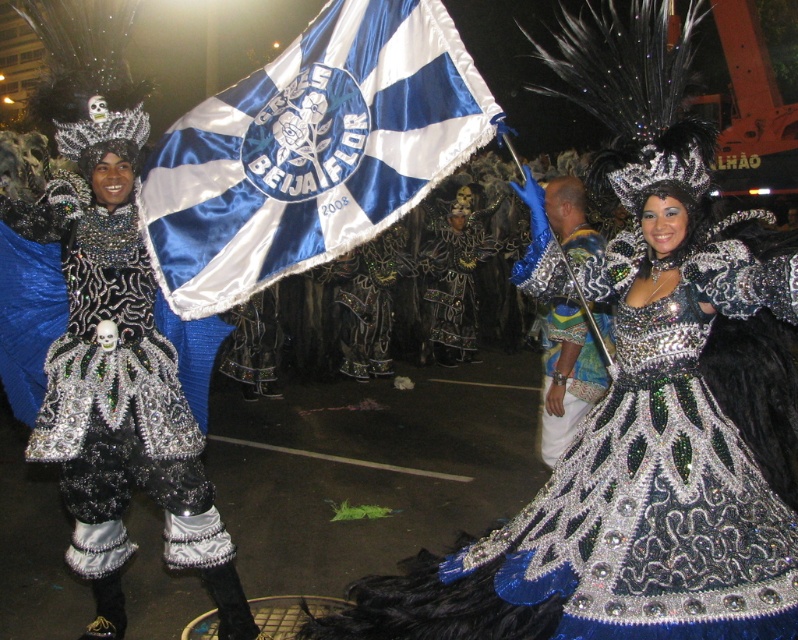
Question: Where is sparkly silver dress at center located in relation to shiny silver dress at center in the image?

Choices:
 (A) right
 (B) left

Answer: (A)

Question: Which point is farther to the camera?

Choices:
 (A) shiny silver dress at center
 (B) blue satin flag at center
 (C) sparkly silver dress at center

Answer: (A)

Question: Does blue satin flag at center have a greater width compared to shiny silver dress at center?

Choices:
 (A) no
 (B) yes

Answer: (B)

Question: Is sparkly silver dress at center behind blue satin flag at center?

Choices:
 (A) no
 (B) yes

Answer: (A)

Question: Which point is closer to the camera?

Choices:
 (A) blue satin flag at center
 (B) shiny silver dress at center
 (C) sparkly silver dress at center

Answer: (C)

Question: Which point appears farthest from the camera in this image?

Choices:
 (A) (571, 634)
 (B) (322, 138)
 (C) (117, 241)

Answer: (C)